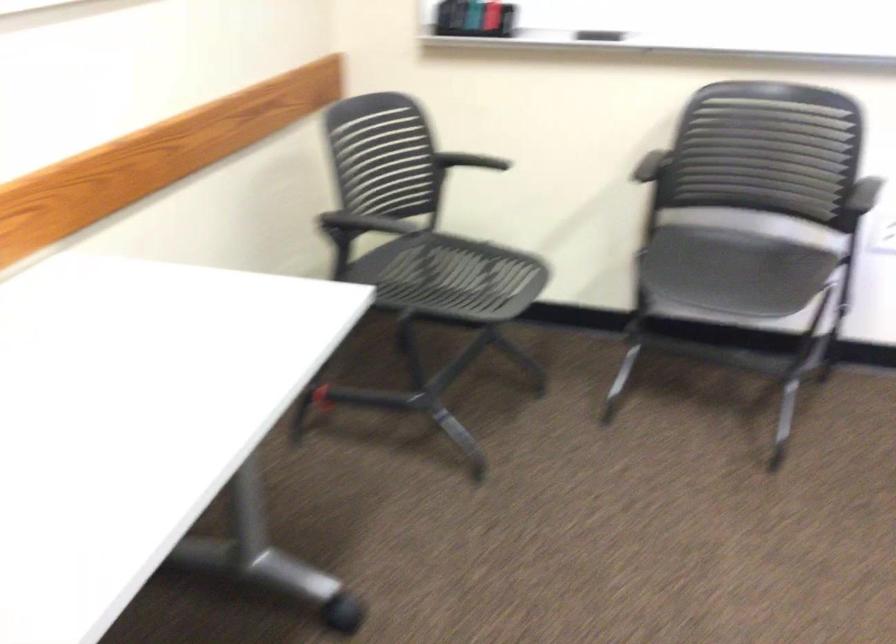
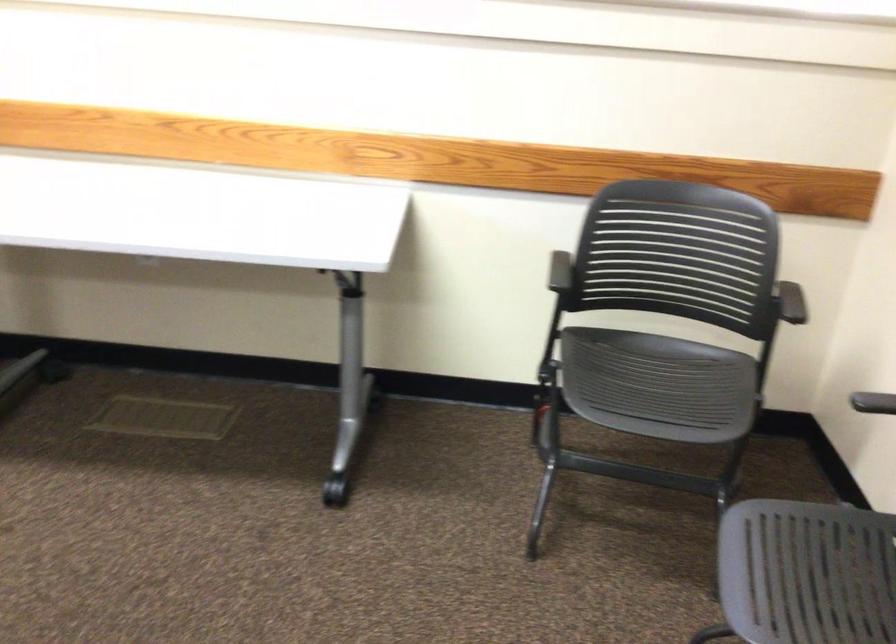
Where in the second image is the point corresponding to (648,172) from the first image?

(873, 402)